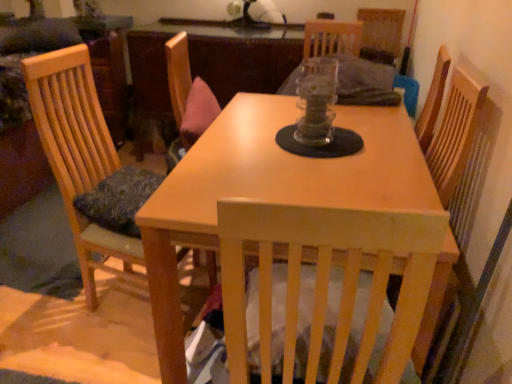
Locate an element on the screen. The height and width of the screenshot is (384, 512). wooden chair at left is located at coordinates (78, 152).

What do you see at coordinates (78, 152) in the screenshot? I see `wooden chair at left` at bounding box center [78, 152].

The height and width of the screenshot is (384, 512). What do you see at coordinates (269, 190) in the screenshot?
I see `light wood table at center` at bounding box center [269, 190].

What is the approximate height of light wood table at center?

It is 77.35 centimeters.

Identify the location of light wood table at center. (269, 190).

Locate an element on the screen. The height and width of the screenshot is (384, 512). wooden chair at left is located at coordinates [x=78, y=152].

Considering the positions of objects light wood table at center and wooden chair at left in the image provided, who is more to the right, light wood table at center or wooden chair at left?

light wood table at center is more to the right.

Considering the relative positions of light wood table at center and wooden chair at left in the image provided, is light wood table at center in front of wooden chair at left?

Yes, light wood table at center is closer to the viewer.

Between point (361, 167) and point (108, 157), which one is positioned behind?

The point (108, 157) is farther from the camera.

Consider the image. From the image's perspective, between light wood table at center and wooden chair at left, which one is located above?

wooden chair at left.

From a real-world perspective, is light wood table at center beneath wooden chair at left?

Yes, from a real-world perspective, light wood table at center is under wooden chair at left.

Looking at this image, which object is thinner, light wood table at center or wooden chair at left?

Thinner between the two is wooden chair at left.

From the picture: Between light wood table at center and wooden chair at left, which one has less height?

light wood table at center.

Considering the sizes of objects light wood table at center and wooden chair at left in the image provided, who is smaller, light wood table at center or wooden chair at left?

With smaller size is wooden chair at left.

Is light wood table at center outside of wooden chair at left?

light wood table at center is positioned outside wooden chair at left.

Is light wood table at center beside wooden chair at left?

No.

Is light wood table at center positioned with its back to wooden chair at left?

light wood table at center does not have its back to wooden chair at left.

How many degrees apart are the facing directions of light wood table at center and wooden chair at left?

170 degrees.

Measure the distance between light wood table at center and wooden chair at left.

light wood table at center is 24.11 inches from wooden chair at left.

This screenshot has height=384, width=512. I want to click on chair above the light wood table at center (from a real-world perspective), so click(x=78, y=152).

Visually, is wooden chair at left positioned to the left or to the right of light wood table at center?

Based on their positions, wooden chair at left is located to the left of light wood table at center.

Is wooden chair at left closer to the viewer compared to light wood table at center?

No, it is behind light wood table at center.

Does point (106, 230) appear closer or farther from the camera than point (197, 232)?

Point (106, 230) is positioned farther from the camera compared to point (197, 232).

From the image's perspective, relative to light wood table at center, is wooden chair at left above or below?

wooden chair at left is above light wood table at center.

From a real-world perspective, is wooden chair at left positioned over light wood table at center based on gravity?

Indeed, from a real-world perspective, wooden chair at left stands above light wood table at center.

Does wooden chair at left have a lesser width compared to light wood table at center?

Yes.

Considering the relative sizes of wooden chair at left and light wood table at center in the image provided, is wooden chair at left shorter than light wood table at center?

Incorrect, the height of wooden chair at left does not fall short of that of light wood table at center.

Does wooden chair at left have a smaller size compared to light wood table at center?

Yes.

Could light wood table at center be considered to be inside wooden chair at left?

No, light wood table at center is not surrounded by wooden chair at left.

Is there a large distance between wooden chair at left and light wood table at center?

No, wooden chair at left is not far from light wood table at center.

Is light wood table at center at the back of wooden chair at left?

wooden chair at left is not turned away from light wood table at center.

Locate an element on the screen. The height and width of the screenshot is (384, 512). chair behind the light wood table at center is located at coordinates coord(78,152).

In order to click on table located in front of the wooden chair at left in this screenshot , I will do `click(269, 190)`.

In order to click on table that appears on the right of wooden chair at left in this screenshot , I will do `click(269, 190)`.